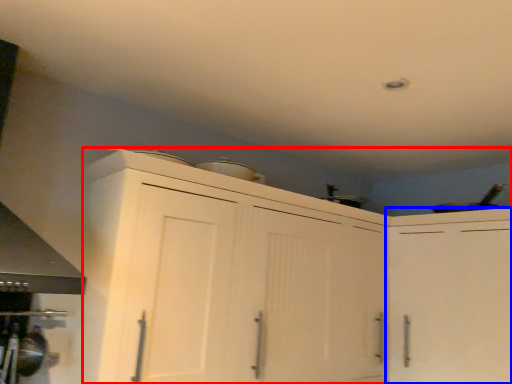
Question: Which of the following is the closest to the observer, cabinetry (highlighted by a red box) or cabinetry (highlighted by a blue box)?

Choices:
 (A) cabinetry
 (B) cabinetry

Answer: (A)